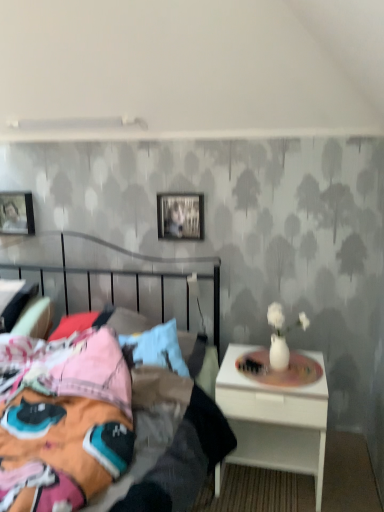
What is the approximate width of white glossy nightstand at right?

17.04 inches.

You are a GUI agent. You are given a task and a screenshot of the screen. Output one action in this format:
    pyautogui.click(x=<x>, y=<y>)
    Task: Click on the metallic silver bed at center
    
    Given the screenshot: What is the action you would take?
    pyautogui.click(x=63, y=419)

From the image's perspective, which is above, metallic silver picture frame at upper center, arranged as the first picture frame when viewed from the front, or metallic silver bed at center?

metallic silver picture frame at upper center, arranged as the first picture frame when viewed from the front, from the image's perspective.

Are metallic silver picture frame at upper center, the 2th picture frame in the back-to-front sequence, and metallic silver bed at center located far from each other?

No, metallic silver picture frame at upper center, the 2th picture frame in the back-to-front sequence, is in close proximity to metallic silver bed at center.

Is metallic silver picture frame at upper center, placed as the first picture frame when sorted from right to left, oriented away from metallic silver bed at center?

That's not correct — metallic silver picture frame at upper center, placed as the first picture frame when sorted from right to left, is not looking away from metallic silver bed at center.

Can you see matte black picture frame at upper left, the 1th picture frame viewed from the left, touching metallic silver bed at center?

No.

From the image's perspective, would you say matte black picture frame at upper left, marked as the 2th picture frame in a right-to-left arrangement, is positioned over metallic silver bed at center?

Correct, matte black picture frame at upper left, marked as the 2th picture frame in a right-to-left arrangement, appears higher than metallic silver bed at center in the image.

Which object is closer to the camera taking this photo, matte black picture frame at upper left, which appears as the 1th picture frame when viewed from the back, or metallic silver bed at center?

metallic silver bed at center.

Could you tell me if white glossy nightstand at right is turned towards metallic silver picture frame at upper center, placed as the first picture frame when sorted from right to left?

No, white glossy nightstand at right is not facing towards metallic silver picture frame at upper center, placed as the first picture frame when sorted from right to left.

Consider the image. How much distance is there between white glossy nightstand at right and metallic silver picture frame at upper center, the 2th picture frame in the back-to-front sequence?

white glossy nightstand at right and metallic silver picture frame at upper center, the 2th picture frame in the back-to-front sequence, are 37.09 inches apart from each other.

Between white glossy nightstand at right and metallic silver picture frame at upper center, the 2th picture frame viewed from the left, which one is positioned in front?

white glossy nightstand at right is more forward.

Consider the image. From a real-world perspective, is matte black picture frame at upper left, arranged as the 2th picture frame when viewed from the front, on top of metallic silver picture frame at upper center, placed as the first picture frame when sorted from right to left?

No.

From the image's perspective, which object appears higher, matte black picture frame at upper left, the 1th picture frame viewed from the left, or metallic silver picture frame at upper center, the 2th picture frame viewed from the left?

matte black picture frame at upper left, the 1th picture frame viewed from the left, appears higher in the image.

The width and height of the screenshot is (384, 512). In order to click on picture frame on the right of matte black picture frame at upper left, marked as the 2th picture frame in a right-to-left arrangement in this screenshot , I will do `click(180, 216)`.

Where is `the 2nd picture frame above the white glossy nightstand at right (from the image's perspective)`? the 2nd picture frame above the white glossy nightstand at right (from the image's perspective) is located at coordinates (16, 213).

Can you confirm if white glossy nightstand at right is bigger than matte black picture frame at upper left, arranged as the 2th picture frame when viewed from the front?

Indeed, white glossy nightstand at right has a larger size compared to matte black picture frame at upper left, arranged as the 2th picture frame when viewed from the front.

Based on the photo, choose the correct answer: Is white glossy nightstand at right inside matte black picture frame at upper left, arranged as the 2th picture frame when viewed from the front, or outside it?

white glossy nightstand at right is located beyond the bounds of matte black picture frame at upper left, arranged as the 2th picture frame when viewed from the front.

Is metallic silver picture frame at upper center, the 2th picture frame in the back-to-front sequence, wider or thinner than matte black picture frame at upper left, the 1th picture frame viewed from the left?

Clearly, metallic silver picture frame at upper center, the 2th picture frame in the back-to-front sequence, has less width compared to matte black picture frame at upper left, the 1th picture frame viewed from the left.

Considering the sizes of metallic silver picture frame at upper center, arranged as the first picture frame when viewed from the front, and matte black picture frame at upper left, marked as the 2th picture frame in a right-to-left arrangement, in the image, is metallic silver picture frame at upper center, arranged as the first picture frame when viewed from the front, bigger or smaller than matte black picture frame at upper left, marked as the 2th picture frame in a right-to-left arrangement,?

Clearly, metallic silver picture frame at upper center, arranged as the first picture frame when viewed from the front, is smaller in size than matte black picture frame at upper left, marked as the 2th picture frame in a right-to-left arrangement.

Considering the sizes of objects metallic silver picture frame at upper center, placed as the first picture frame when sorted from right to left, and matte black picture frame at upper left, the 1th picture frame viewed from the left, in the image provided, who is taller, metallic silver picture frame at upper center, placed as the first picture frame when sorted from right to left, or matte black picture frame at upper left, the 1th picture frame viewed from the left,?

metallic silver picture frame at upper center, placed as the first picture frame when sorted from right to left.

Is white glossy nightstand at right turned away from metallic silver bed at center?

No.

Considering the relative sizes of white glossy nightstand at right and metallic silver bed at center in the image provided, is white glossy nightstand at right thinner than metallic silver bed at center?

Yes, white glossy nightstand at right is thinner than metallic silver bed at center.

Based on the photo, is the position of white glossy nightstand at right less distant than that of metallic silver bed at center?

No.

Which is less distant, (225, 459) or (50, 401)?

Point (225, 459).

Image resolution: width=384 pixels, height=512 pixels. Find the location of `bed that appears in front of the metallic silver picture frame at upper center, placed as the first picture frame when sorted from right to left`. bed that appears in front of the metallic silver picture frame at upper center, placed as the first picture frame when sorted from right to left is located at coordinates (63, 419).

Find the location of a particular element. This screenshot has width=384, height=512. bed that is below the matte black picture frame at upper left, arranged as the 2th picture frame when viewed from the front (from the image's perspective) is located at coordinates (63, 419).

Based on their spatial positions, is matte black picture frame at upper left, the 1th picture frame viewed from the left, or white glossy nightstand at right closer to metallic silver picture frame at upper center, the 2th picture frame viewed from the left?

matte black picture frame at upper left, the 1th picture frame viewed from the left.

From the image, which object appears to be nearer to white glossy nightstand at right, metallic silver bed at center or metallic silver picture frame at upper center, arranged as the first picture frame when viewed from the front?

metallic silver bed at center is positioned closer to the anchor white glossy nightstand at right.

From the image, which object appears to be nearer to matte black picture frame at upper left, the 1th picture frame viewed from the left, metallic silver bed at center or metallic silver picture frame at upper center, placed as the first picture frame when sorted from right to left?

metallic silver picture frame at upper center, placed as the first picture frame when sorted from right to left, lies closer to matte black picture frame at upper left, the 1th picture frame viewed from the left, than the other object.

Based on their spatial positions, is matte black picture frame at upper left, the 1th picture frame viewed from the left, or metallic silver picture frame at upper center, placed as the first picture frame when sorted from right to left, closer to white glossy nightstand at right?

metallic silver picture frame at upper center, placed as the first picture frame when sorted from right to left.

Considering their positions, is matte black picture frame at upper left, the 1th picture frame viewed from the left, positioned closer to white glossy nightstand at right than metallic silver bed at center?

metallic silver bed at center is positioned closer to the anchor white glossy nightstand at right.

In the scene shown: When comparing their distances from metallic silver bed at center, does white glossy nightstand at right or matte black picture frame at upper left, marked as the 2th picture frame in a right-to-left arrangement, seem further?

matte black picture frame at upper left, marked as the 2th picture frame in a right-to-left arrangement, is positioned further to the anchor metallic silver bed at center.

Based on their spatial positions, is metallic silver bed at center or matte black picture frame at upper left, marked as the 2th picture frame in a right-to-left arrangement, further from metallic silver picture frame at upper center, the 2th picture frame in the back-to-front sequence?

Based on the image, metallic silver bed at center appears to be further to metallic silver picture frame at upper center, the 2th picture frame in the back-to-front sequence.

Based on their spatial positions, is matte black picture frame at upper left, arranged as the 2th picture frame when viewed from the front, or metallic silver picture frame at upper center, the 2th picture frame in the back-to-front sequence, further from metallic silver bed at center?

matte black picture frame at upper left, arranged as the 2th picture frame when viewed from the front.

At what (x,y) coordinates should I click in order to perform the action: click on picture frame between matte black picture frame at upper left, marked as the 2th picture frame in a right-to-left arrangement, and white glossy nightstand at right. Please return your answer as a coordinate pair (x, y). Looking at the image, I should click on (180, 216).

Locate an element on the screen. nightstand between metallic silver bed at center and matte black picture frame at upper left, which appears as the 1th picture frame when viewed from the back, in the front-back direction is located at coordinates (275, 419).

Where is `nightstand located between metallic silver bed at center and metallic silver picture frame at upper center, arranged as the first picture frame when viewed from the front, in the depth direction`? This screenshot has width=384, height=512. nightstand located between metallic silver bed at center and metallic silver picture frame at upper center, arranged as the first picture frame when viewed from the front, in the depth direction is located at coordinates (275, 419).

The width and height of the screenshot is (384, 512). In order to click on picture frame located between metallic silver bed at center and matte black picture frame at upper left, which appears as the 1th picture frame when viewed from the back, in the depth direction in this screenshot , I will do `click(180, 216)`.